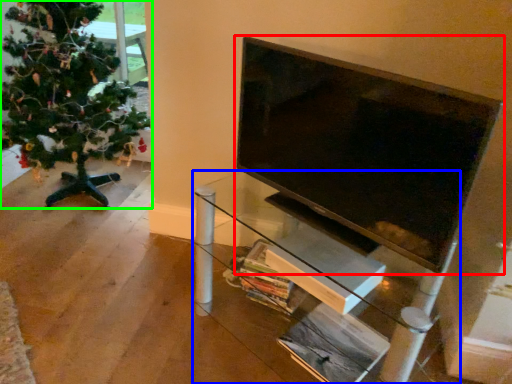
Question: Which object is positioned closest to television (highlighted by a red box)? Select from furniture (highlighted by a blue box) and christmas tree (highlighted by a green box).

Choices:
 (A) furniture
 (B) christmas tree

Answer: (A)